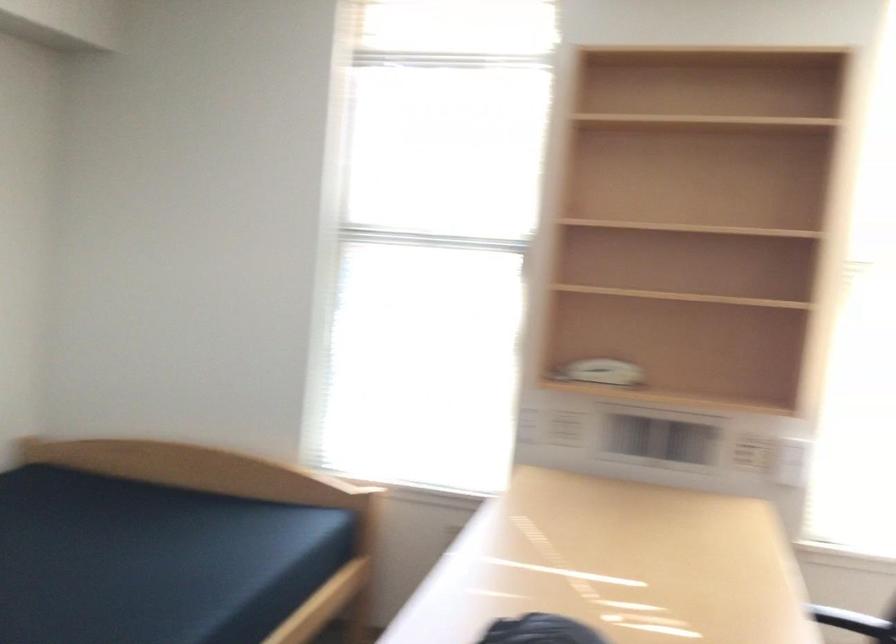
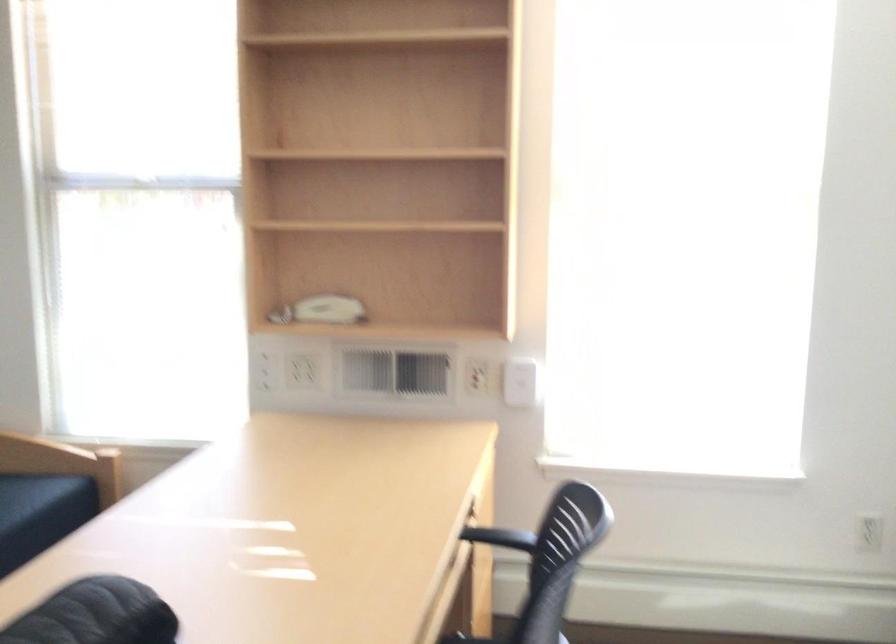
Question: The camera is either moving clockwise (left) or counter-clockwise (right) around the object. The first image is from the beginning of the video and the second image is from the end. Is the camera moving left or right when shooting the video?

Choices:
 (A) Left
 (B) Right

Answer: (A)